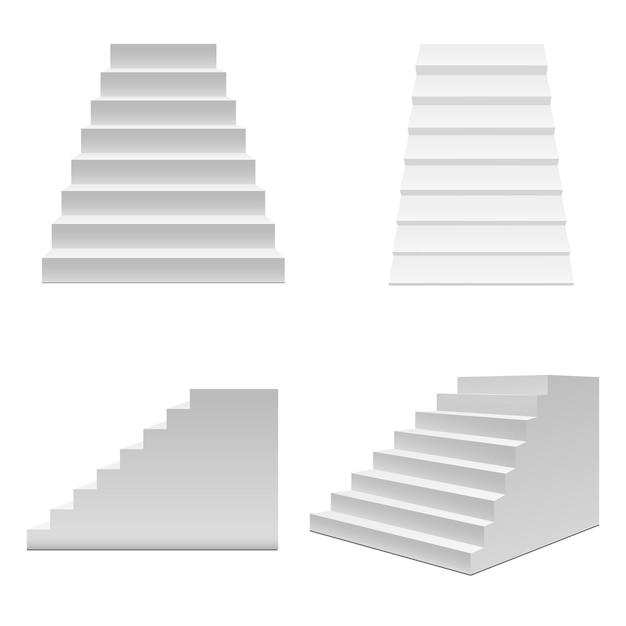
The height and width of the screenshot is (626, 626). In order to click on step on lower left staircase in this screenshot , I will do `click(31, 531)`, `click(59, 506)`, `click(84, 490)`, `click(104, 464)`, `click(131, 448)`, `click(155, 428)`, `click(178, 406)`, `click(198, 387)`.